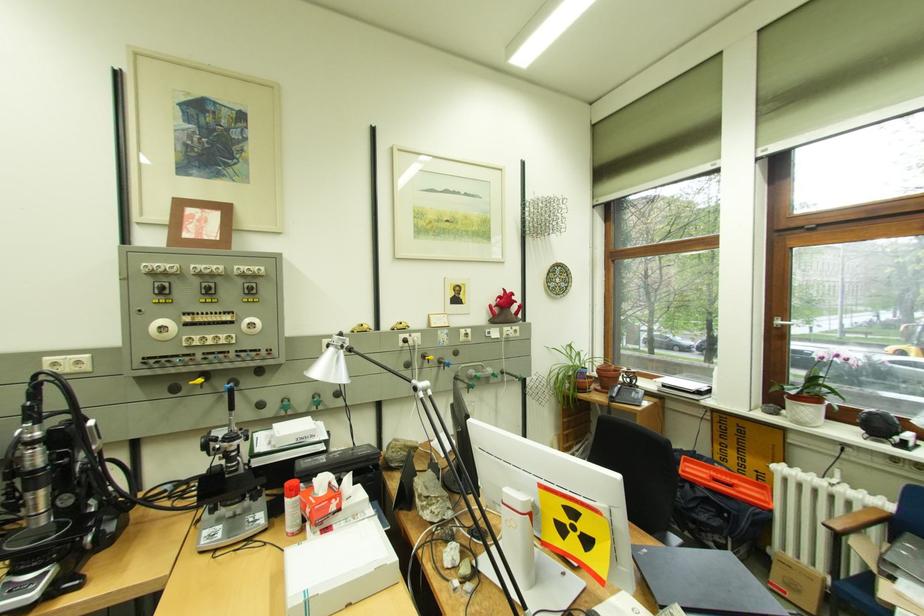
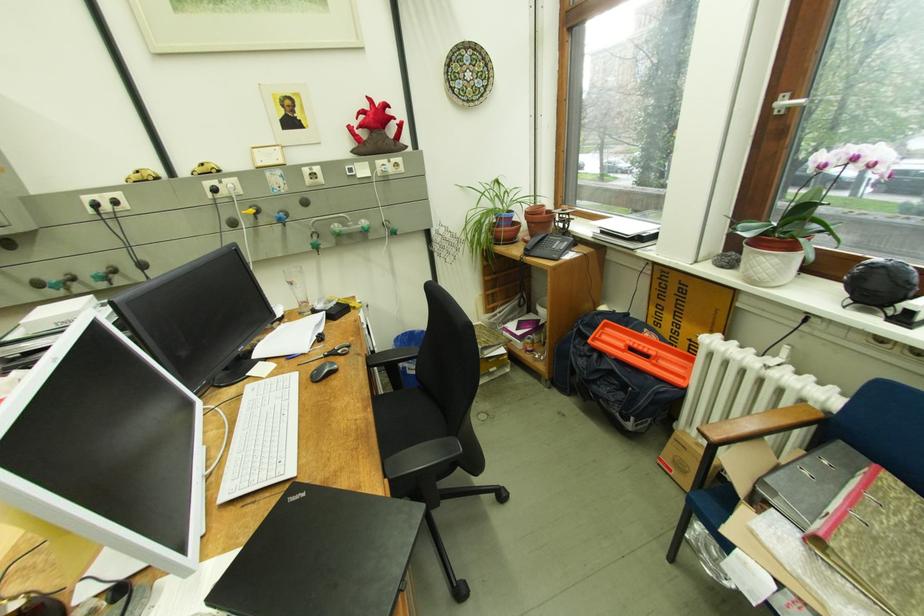
Where in the second image is the point corresponding to the point at 788,323 from the first image?

(794, 103)